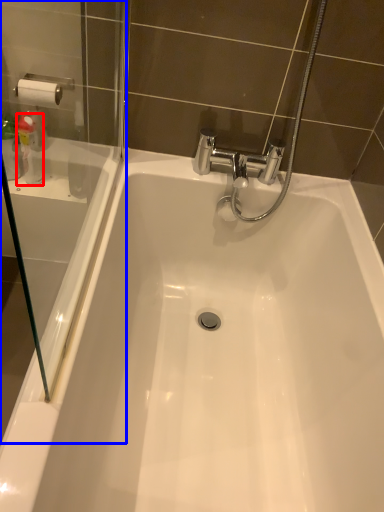
Question: Which object appears farthest to the camera in this image, cleaning product (highlighted by a red box) or screen door (highlighted by a blue box)?

Choices:
 (A) cleaning product
 (B) screen door

Answer: (A)